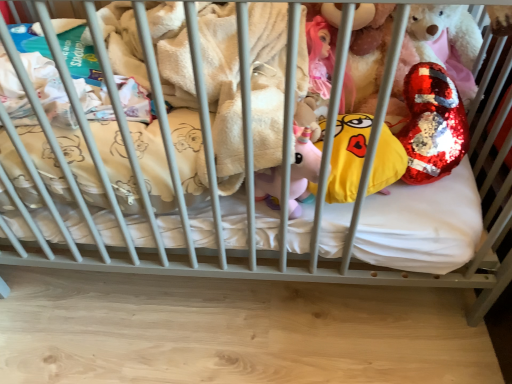
Question: Is shiny sequined heart at upper right to the left of yellow sequined pillow at center from the viewer's perspective?

Choices:
 (A) no
 (B) yes

Answer: (A)

Question: Does shiny sequined heart at upper right have a greater height compared to yellow sequined pillow at center?

Choices:
 (A) yes
 (B) no

Answer: (A)

Question: Can we say shiny sequined heart at upper right lies outside yellow sequined pillow at center?

Choices:
 (A) no
 (B) yes

Answer: (B)

Question: Considering the relative sizes of shiny sequined heart at upper right and yellow sequined pillow at center in the image provided, is shiny sequined heart at upper right thinner than yellow sequined pillow at center?

Choices:
 (A) no
 (B) yes

Answer: (A)

Question: Is shiny sequined heart at upper right oriented away from yellow sequined pillow at center?

Choices:
 (A) yes
 (B) no

Answer: (B)

Question: Is yellow sequined pillow at center to the left or to the right of shiny sequined heart at upper right in the image?

Choices:
 (A) right
 (B) left

Answer: (B)

Question: In terms of width, does yellow sequined pillow at center look wider or thinner when compared to shiny sequined heart at upper right?

Choices:
 (A) wide
 (B) thin

Answer: (B)

Question: From a real-world perspective, relative to shiny sequined heart at upper right, is yellow sequined pillow at center vertically above or below?

Choices:
 (A) above
 (B) below

Answer: (B)

Question: From their relative heights in the image, would you say yellow sequined pillow at center is taller or shorter than shiny sequined heart at upper right?

Choices:
 (A) tall
 (B) short

Answer: (B)

Question: Would you say shiny sequined heart at upper right is inside or outside white soft mattress at center?

Choices:
 (A) inside
 (B) outside

Answer: (B)

Question: Does point (438, 109) appear closer or farther from the camera than point (401, 259)?

Choices:
 (A) closer
 (B) farther

Answer: (B)

Question: Is shiny sequined heart at upper right in front of or behind white soft mattress at center in the image?

Choices:
 (A) behind
 (B) front

Answer: (B)

Question: From the image's perspective, relative to white soft mattress at center, is shiny sequined heart at upper right above or below?

Choices:
 (A) above
 (B) below

Answer: (A)

Question: From the image's perspective, is white soft mattress at center located above or below yellow sequined pillow at center?

Choices:
 (A) below
 (B) above

Answer: (B)

Question: Choose the correct answer: Is white soft mattress at center inside yellow sequined pillow at center or outside it?

Choices:
 (A) inside
 (B) outside

Answer: (B)